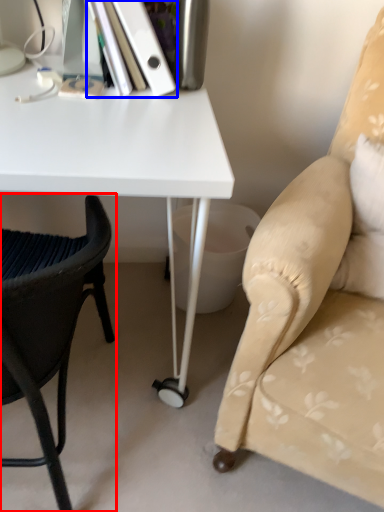
Question: Which point is further to the camera, chair (highlighted by a red box) or paperback book (highlighted by a blue box)?

Choices:
 (A) chair
 (B) paperback book

Answer: (B)